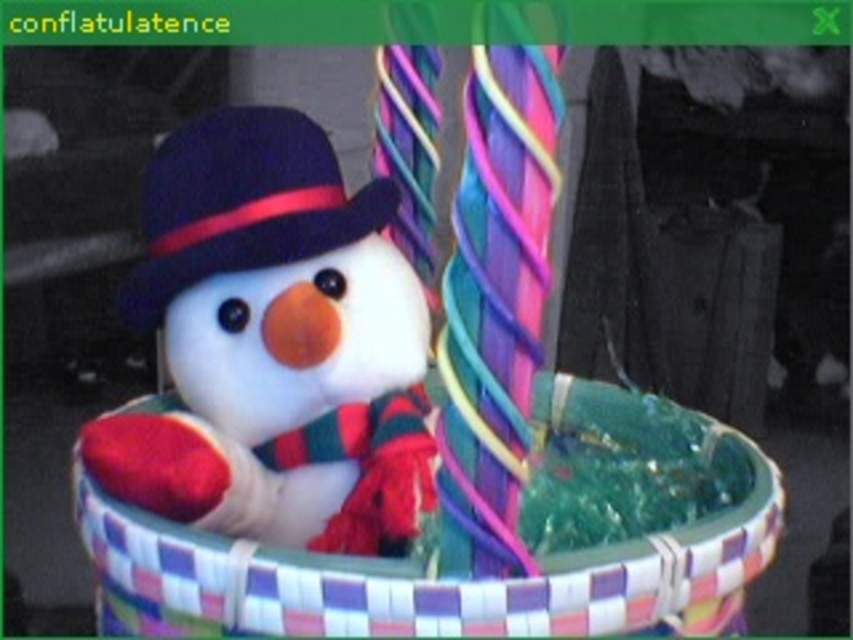
Question: Which object is farther from the camera taking this photo?

Choices:
 (A) white plush snowman at center
 (B) woven fabric basket at center

Answer: (A)

Question: Is white plush snowman at center positioned before woven fabric basket at center?

Choices:
 (A) no
 (B) yes

Answer: (A)

Question: Estimate the real-world distances between objects in this image. Which object is closer to the white plush snowman at center?

Choices:
 (A) woven fabric basket at center
 (B) velvet-like dark blue dress hat at upper left

Answer: (B)

Question: Which point is farther to the camera?

Choices:
 (A) velvet-like dark blue dress hat at upper left
 (B) woven fabric basket at center
 (C) white plush snowman at center

Answer: (A)

Question: Does white plush snowman at center appear over velvet-like dark blue dress hat at upper left?

Choices:
 (A) yes
 (B) no

Answer: (B)

Question: Can you confirm if white plush snowman at center is bigger than velvet-like dark blue dress hat at upper left?

Choices:
 (A) no
 (B) yes

Answer: (B)